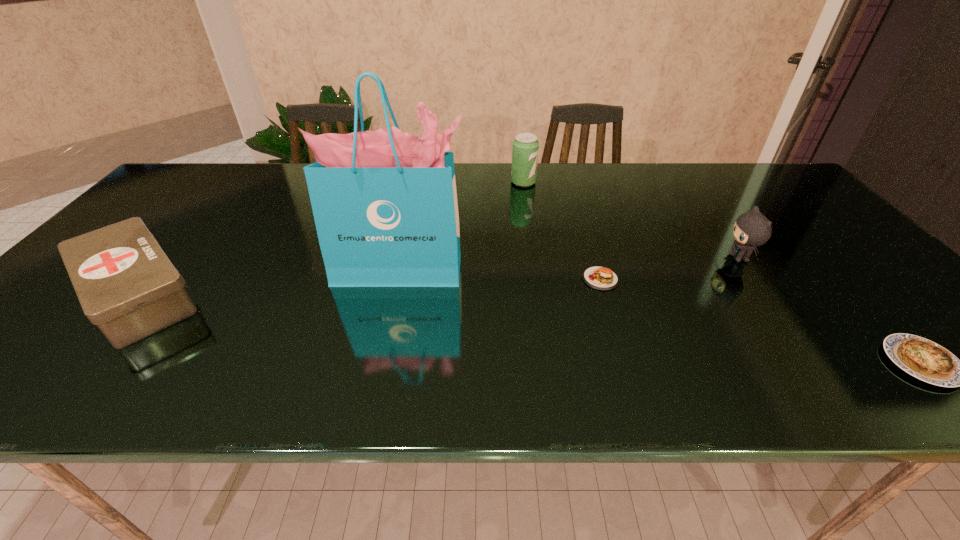
In order to click on vacant area located 0.100m on the front-facing side of the kitten in this screenshot , I will do `click(685, 258)`.

Where is `vacant space positioned on the front-facing side of the kitten`? vacant space positioned on the front-facing side of the kitten is located at coordinates (580, 258).

You are a GUI agent. You are given a task and a screenshot of the screen. Output one action in this format:
    pyautogui.click(x=<x>, y=<y>)
    Task: Click on the vacant space located 0.110m on the front-facing side of the kitten
    
    Given the screenshot: What is the action you would take?
    pyautogui.click(x=681, y=258)

What are the coordinates of `free point located on the back of the first-aid kit` in the screenshot? It's located at (188, 236).

Where is `free region located 0.120m on the back of the patty (food)`? free region located 0.120m on the back of the patty (food) is located at coordinates (588, 239).

This screenshot has width=960, height=540. Identify the location of object that is at the far edge. (525, 150).

Identify the location of object that is positioned at the left edge. This screenshot has height=540, width=960. (127, 286).

Find the location of a particular element. vacant space at the far edge is located at coordinates (608, 179).

At what (x,y) coordinates should I click in order to perform the action: click on free region at the near edge. Please return your answer as a coordinate pair (x, y). Looking at the image, I should click on (209, 394).

The width and height of the screenshot is (960, 540). In the image, there is a desktop. In order to click on vacant area at the right edge in this screenshot , I will do `click(822, 238)`.